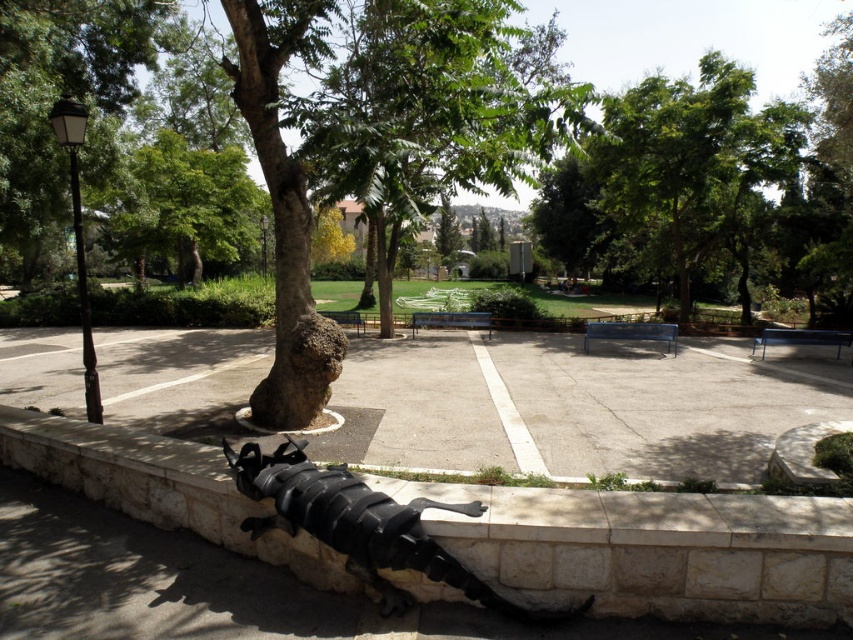
Does green leafy tree at upper right appear on the right side of black matte sculpture at lower center?

Yes, green leafy tree at upper right is to the right of black matte sculpture at lower center.

Who is more distant from viewer, [602,225] or [329,497]?

Positioned behind is point [602,225].

Locate an element on the screen. This screenshot has width=853, height=640. green leafy tree at upper right is located at coordinates (689, 163).

Who is positioned more to the right, green leafy tree at center or black matte sculpture at lower center?

green leafy tree at center is more to the right.

From the picture: Who is lower down, green leafy tree at center or black matte sculpture at lower center?

black matte sculpture at lower center is below.

Describe the element at coordinates (434, 112) in the screenshot. I see `green leafy tree at center` at that location.

I want to click on green leafy tree at center, so click(x=434, y=112).

What do you see at coordinates (689, 163) in the screenshot? I see `green leafy tree at upper right` at bounding box center [689, 163].

You are a GUI agent. You are given a task and a screenshot of the screen. Output one action in this format:
    pyautogui.click(x=<x>, y=<y>)
    Task: Click on the green leafy tree at upper right
    The height and width of the screenshot is (640, 853).
    Given the screenshot: What is the action you would take?
    [x=689, y=163]

Which is behind, point (737, 216) or point (119, 90)?

The point (737, 216) is behind.

Find the location of `green leafy tree at upper right`. green leafy tree at upper right is located at coordinates (689, 163).